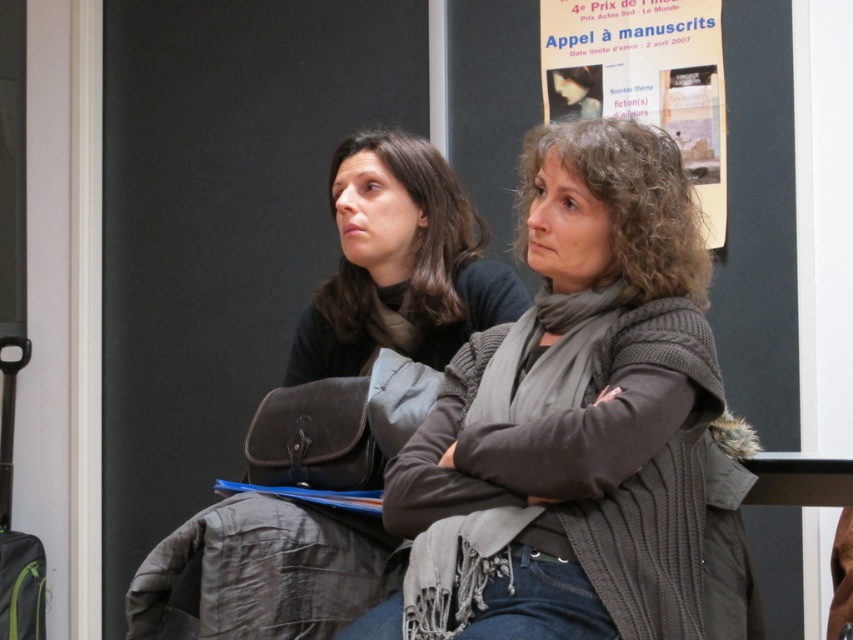
Does knitted gray sweater at center have a smaller size compared to paper poster at upper center?

Actually, knitted gray sweater at center might be larger than paper poster at upper center.

Can you confirm if knitted gray sweater at center is positioned below paper poster at upper center?

Correct, knitted gray sweater at center is located below paper poster at upper center.

Is point (660, 481) positioned before point (648, 77)?

Yes, point (660, 481) is closer to viewer.

Locate an element on the screen. knitted gray sweater at center is located at coordinates (583, 404).

Does knitted gray sweater at center have a larger size compared to matte black jacket at center?

Yes.

Can you confirm if knitted gray sweater at center is positioned to the right of matte black jacket at center?

Indeed, knitted gray sweater at center is positioned on the right side of matte black jacket at center.

Image resolution: width=853 pixels, height=640 pixels. What are the coordinates of `knitted gray sweater at center` in the screenshot? It's located at (583, 404).

Based on the photo, can you confirm if matte black jacket at center is positioned to the right of paper poster at upper center?

Incorrect, matte black jacket at center is not on the right side of paper poster at upper center.

Is point (444, 314) closer to viewer compared to point (556, 38)?

That is True.

Is point (372, 346) behind point (614, 76)?

That is False.

The image size is (853, 640). I want to click on matte black jacket at center, so click(x=399, y=262).